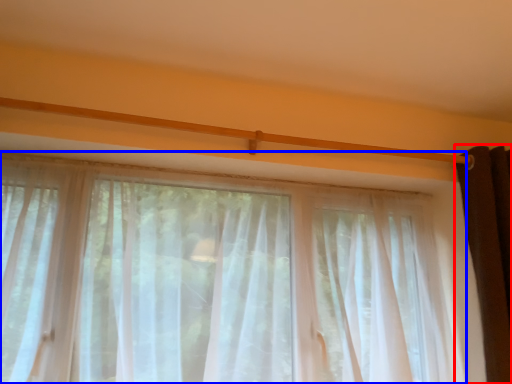
Question: Among these objects, which one is farthest to the camera, curtain (highlighted by a red box) or curtain (highlighted by a blue box)?

Choices:
 (A) curtain
 (B) curtain

Answer: (A)